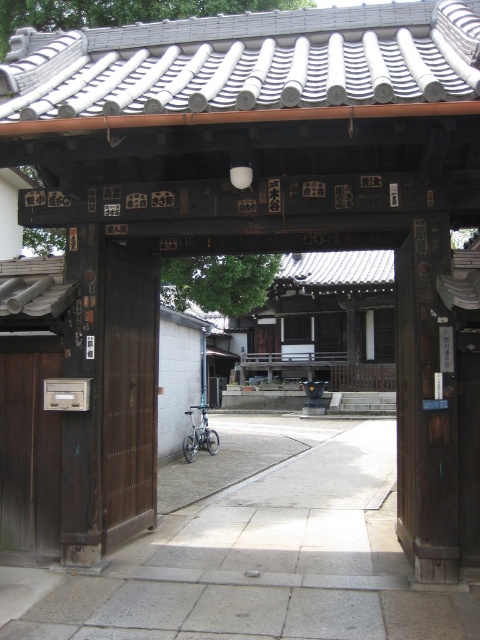
Does gray concrete pavement at center have a greater width compared to brown wooden door at center?

Yes.

Is gray concrete pavement at center positioned in front of brown wooden door at center?

Yes, gray concrete pavement at center is in front of brown wooden door at center.

Does point (361, 422) come behind point (108, 310)?

Yes, it is.

This screenshot has width=480, height=640. In order to click on gray concrete pavement at center in this screenshot , I will do `click(260, 560)`.

Between brown wooden door at center and dark brown wood door at left, which one is positioned lower?

dark brown wood door at left is below.

At what (x,y) coordinates should I click in order to perform the action: click on brown wooden door at center. Please return your answer as a coordinate pair (x, y). The height and width of the screenshot is (640, 480). Looking at the image, I should click on (129, 392).

Between point (117, 534) and point (43, 416), which one is positioned behind?

The point (117, 534) is behind.

Image resolution: width=480 pixels, height=640 pixels. Find the location of `brown wooden door at center`. brown wooden door at center is located at coordinates (129, 392).

Who is lower down, gray concrete pavement at center or dark brown wood door at left?

gray concrete pavement at center is below.

How much distance is there between gray concrete pavement at center and dark brown wood door at left?

gray concrete pavement at center and dark brown wood door at left are 2.20 meters apart.

The height and width of the screenshot is (640, 480). Describe the element at coordinates (260, 560) in the screenshot. I see `gray concrete pavement at center` at that location.

Where is `gray concrete pavement at center`? gray concrete pavement at center is located at coordinates (260, 560).